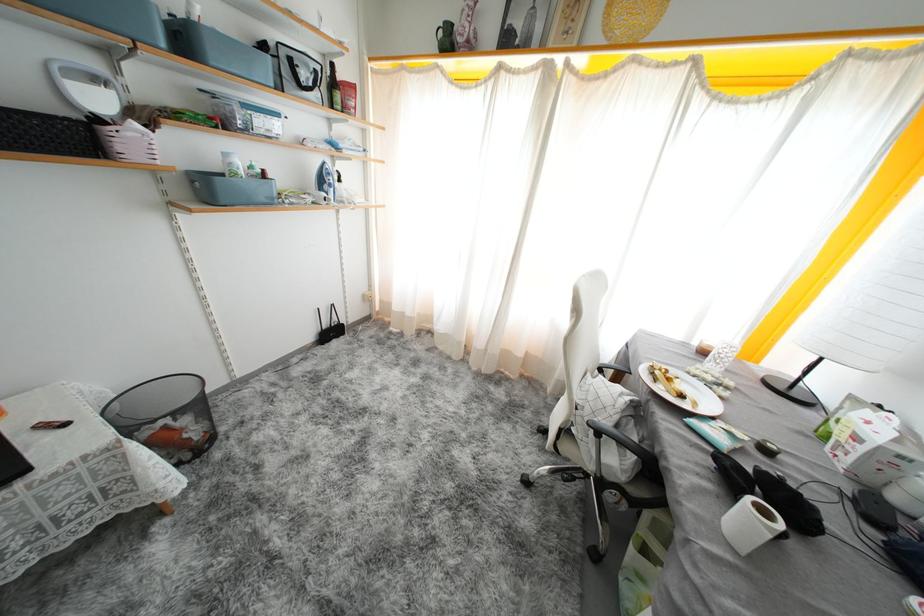
Find the location of a particular element. The height and width of the screenshot is (616, 924). pink storage basket is located at coordinates (128, 142).